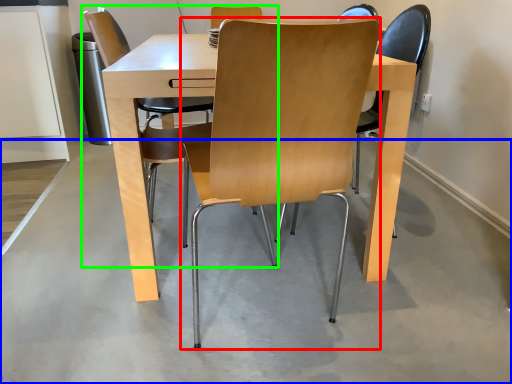
Question: Estimate the real-world distances between objects in this image. Which object is farther from chair (highlighted by a red box), concrete (highlighted by a blue box) or chair (highlighted by a green box)?

Choices:
 (A) concrete
 (B) chair

Answer: (B)